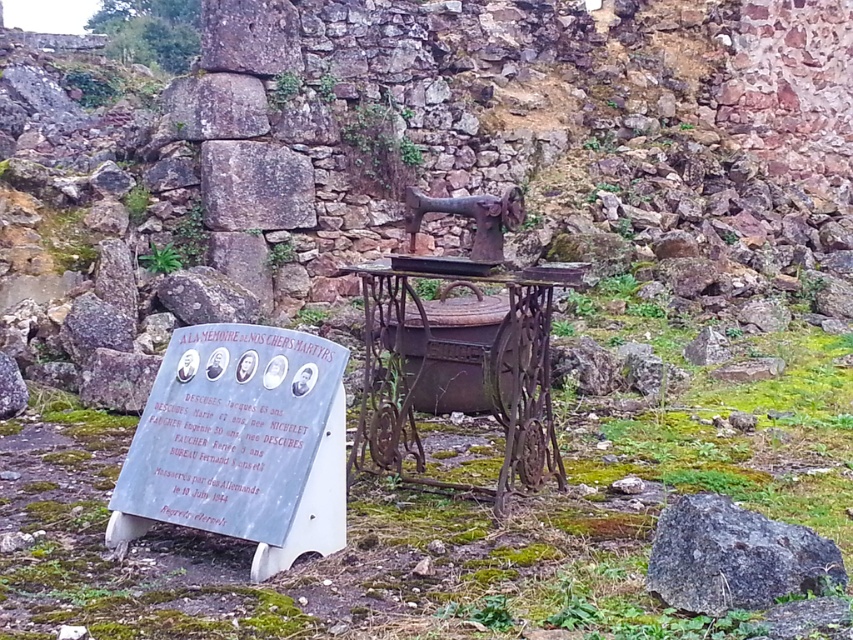
What do you see at coordinates (241, 444) in the screenshot? This screenshot has width=853, height=640. I see `gray stone plaque at center` at bounding box center [241, 444].

Identify the location of gray stone plaque at center. (241, 444).

The image size is (853, 640). I want to click on gray stone plaque at center, so click(241, 444).

Between point (538, 317) and point (281, 154), which one is positioned in front?

Point (538, 317) is more forward.

Which is more to the right, rusty metal sewing machine at center or smooth gray rock at center?

rusty metal sewing machine at center

Does point (399, 321) come in front of point (257, 228)?

Yes, it is in front of point (257, 228).

Identify the location of rusty metal sewing machine at center. This screenshot has width=853, height=640. (459, 362).

Can you confirm if gray stone plaque at center is shorter than rusty metal sewing machine at center?

Correct, gray stone plaque at center is not as tall as rusty metal sewing machine at center.

Can you confirm if gray stone plaque at center is bigger than rusty metal sewing machine at center?

No.

At what (x,y) coordinates should I click in order to perform the action: click on gray stone plaque at center. Please return your answer as a coordinate pair (x, y). Image resolution: width=853 pixels, height=640 pixels. Looking at the image, I should click on (241, 444).